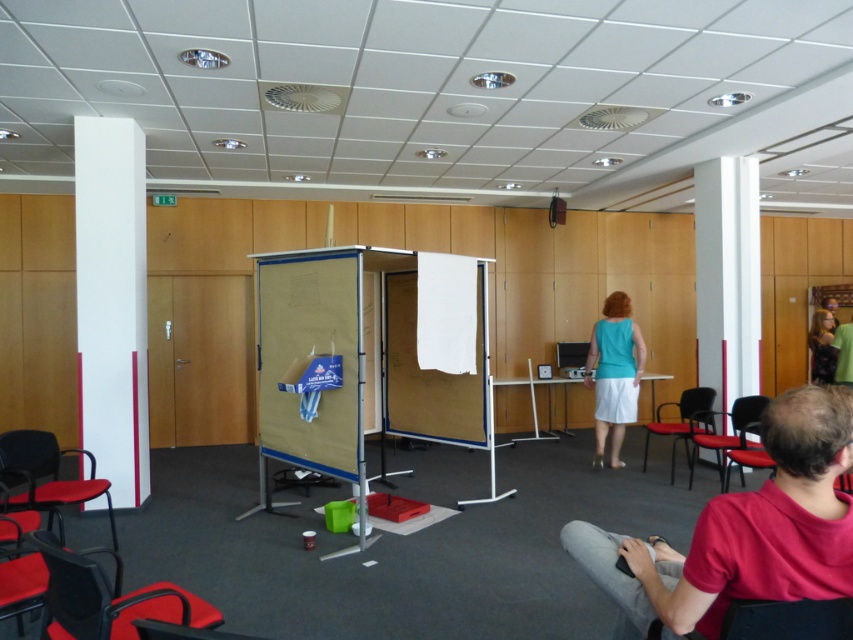
You are standing in the conference room and want to reach the white smooth pillar at left. If your maximum comfortable walking distance is 5 meters, can you comfortably walk to it without feeling strained?

The white smooth pillar at left is 5.10 meters away from the camera, which exceeds your maximum comfortable walking distance of 5 meters. Therefore, walking to it might feel slightly strained.

Looking at this image, you are standing at the point labeled point (84, 323) in the conference room. You want to take a photo of the entire room from your current position. Is the camera close enough to capture the entire room in one shot?

The camera is 17.06 feet away from point (84, 323). Whether this distance allows capturing the entire room depends on the camera lens and field of view. However, since the question doesn not provide specific camera specifications, we cannot definitively confirm if the entire room can be captured in one shot.

You are standing in the conference room and need to move from the white smooth pillar at left to the black leather chair at lower right. Which direction should you move relative to the pillar?

You should move to the right relative to the white smooth pillar at left to reach the black leather chair at lower right, as the pillar is positioned over the chair.